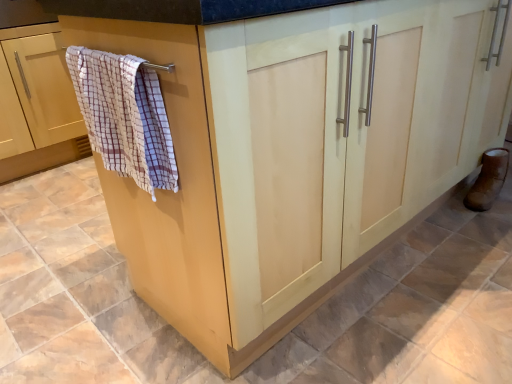
The width and height of the screenshot is (512, 384). What are the coordinates of `free space in front of brown leather boot at lower right` in the screenshot? It's located at (492, 219).